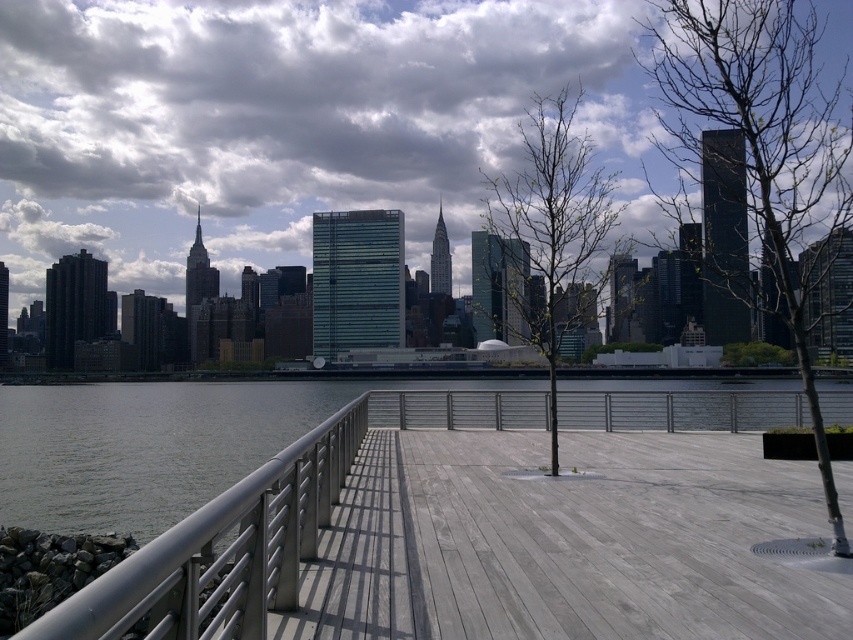
You are standing on the smooth gray wood deck at center and want to walk towards the green leafy tree at center. Which direction should you move?

You should move to the right to reach the green leafy tree at center because the smooth gray wood deck at center is to the left of it.

You are standing on the smooth gray wood deck at center and want to see the city skyline in the background. Since the bare wood tree at center is blocking your view, can you see the skyline over the top of the tree?

The smooth gray wood deck at center is shorter than the bare wood tree at center, so the tree is taller. Since you are standing on the deck, which is shorter than the tree, the tree would block your view of the skyline.